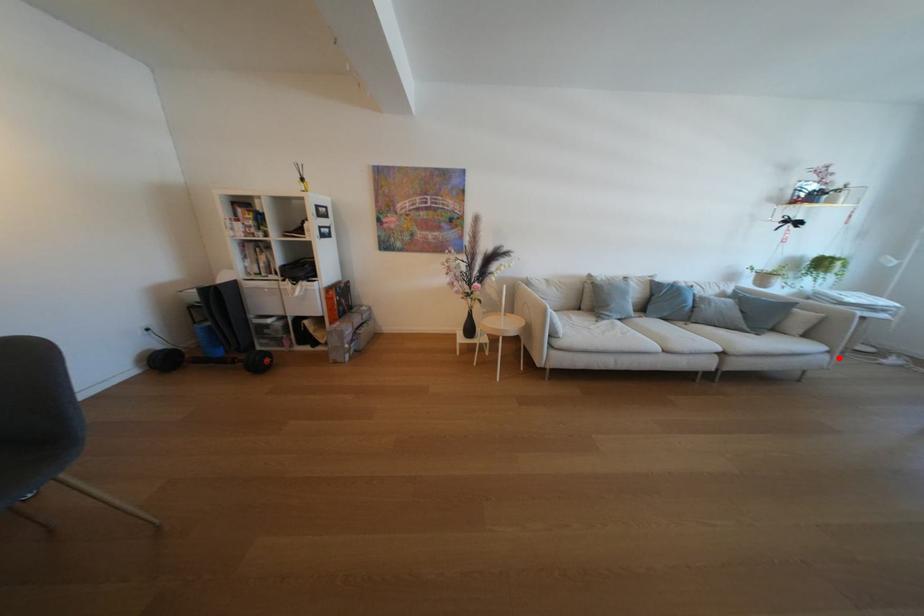
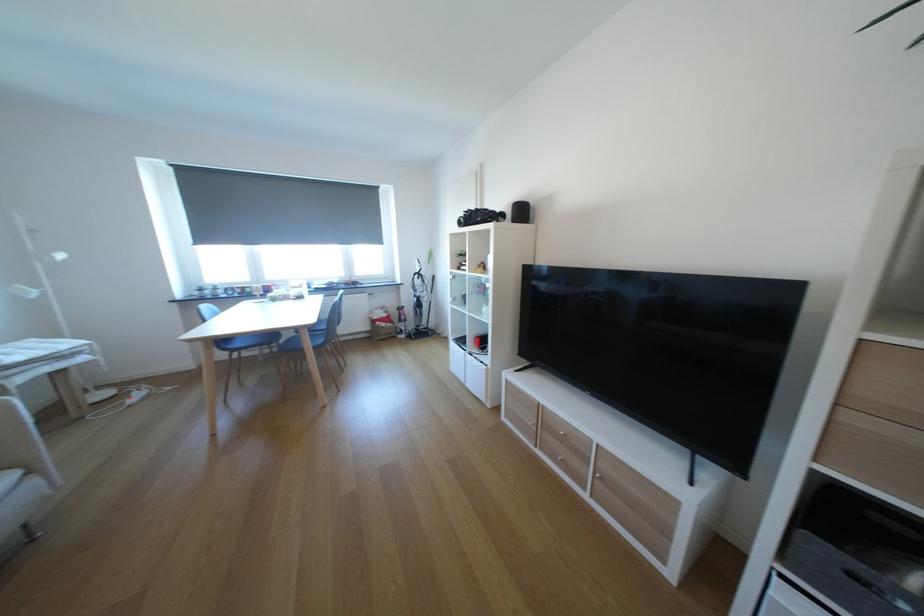
The point at the highlighted location is marked in the first image. Where is the corresponding point in the second image?

(45, 483)